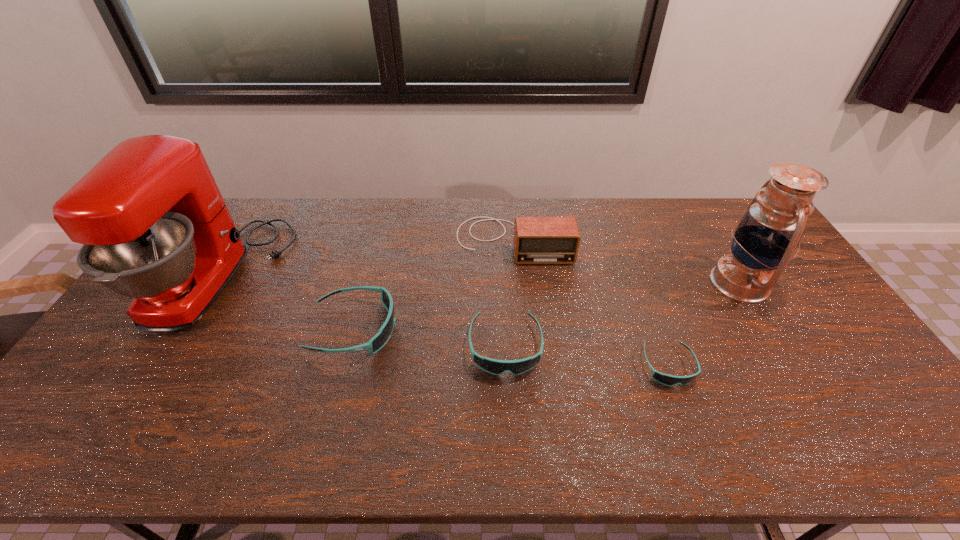
Find the location of `vacant spot to place a sunglasses on the right`. vacant spot to place a sunglasses on the right is located at coordinates (844, 386).